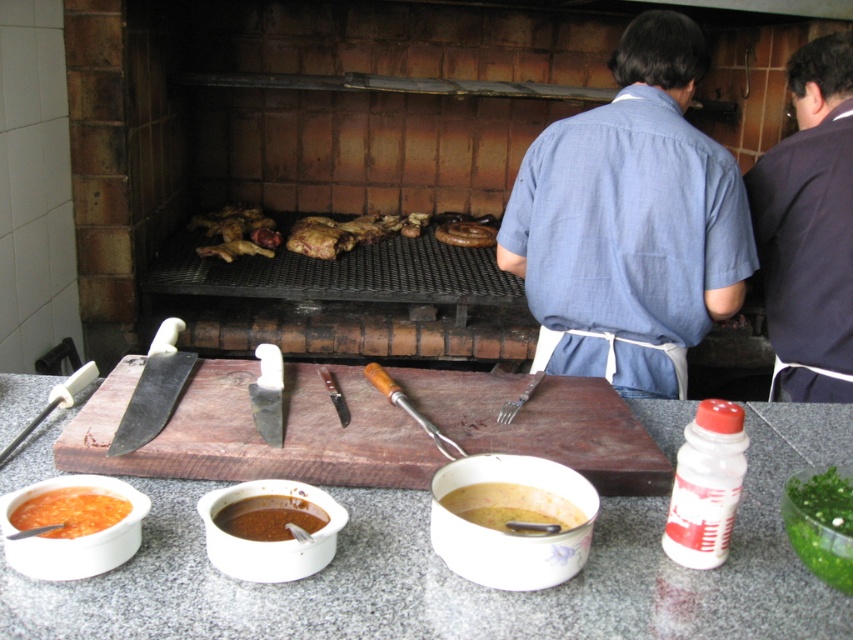
Question: Which point is closer to the camera?

Choices:
 (A) brown matte sausage at center
 (B) yellowish matte soup at lower center
 (C) brown wood cutting board at center
 (D) green leafy vegetable at lower right

Answer: (D)

Question: Does granite gray counter top at lower center appear on the right side of yellowish matte soup at lower center?

Choices:
 (A) yes
 (B) no

Answer: (B)

Question: Which point appears farthest from the camera in this image?

Choices:
 (A) (x=57, y=461)
 (B) (x=824, y=554)
 (C) (x=556, y=518)

Answer: (A)

Question: Which point is farther from the camera taking this photo?

Choices:
 (A) (849, 493)
 (B) (708, 164)
 (C) (393, 440)
 (D) (482, 236)

Answer: (D)

Question: Is dark blue shirt at upper right smaller than brown matte sausage at center?

Choices:
 (A) no
 (B) yes

Answer: (A)

Question: Considering the relative positions of brown wood cutting board at center and brown matte sausage at center in the image provided, where is brown wood cutting board at center located with respect to brown matte sausage at center?

Choices:
 (A) below
 (B) above

Answer: (A)